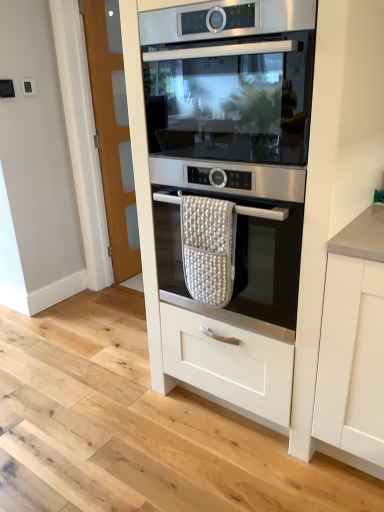
Find the location of a particular element. This screenshot has width=384, height=512. free space in front of stainless steel oven at center, marked as the second oven in a bottom-to-top arrangement is located at coordinates (241, 473).